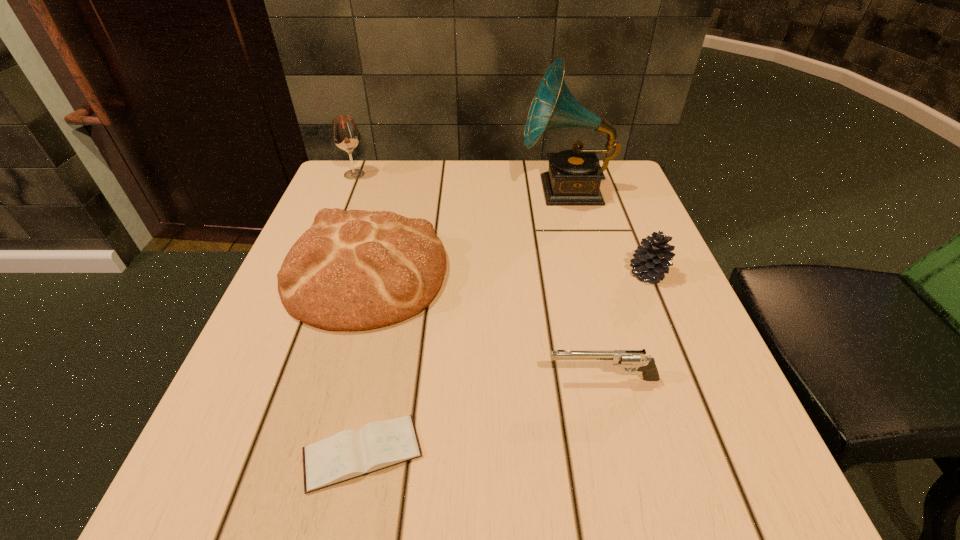
This screenshot has height=540, width=960. Identify the location of object present at the near edge. (349, 454).

Identify the location of wineglass that is positioned at the left edge. The height and width of the screenshot is (540, 960). (345, 134).

Find the location of a particular element. The height and width of the screenshot is (540, 960). bread present at the left edge is located at coordinates (353, 270).

You are a GUI agent. You are given a task and a screenshot of the screen. Output one action in this format:
    pyautogui.click(x=<x>, y=<y>)
    Task: Click on the diary positioned at the left edge
    
    Given the screenshot: What is the action you would take?
    pyautogui.click(x=349, y=454)

Locate an element on the screen. This screenshot has width=960, height=540. phonograph_record at the right edge is located at coordinates (574, 176).

Locate an element on the screen. The height and width of the screenshot is (540, 960). pinecone at the right edge is located at coordinates (652, 261).

Locate an element on the screen. pistol located at the right edge is located at coordinates (646, 364).

Locate an element on the screen. This screenshot has height=540, width=960. object located in the far left corner section of the desktop is located at coordinates (345, 134).

Locate an element on the screen. object at the near left corner is located at coordinates (349, 454).

Identify the location of object located at the far right corner. (574, 176).